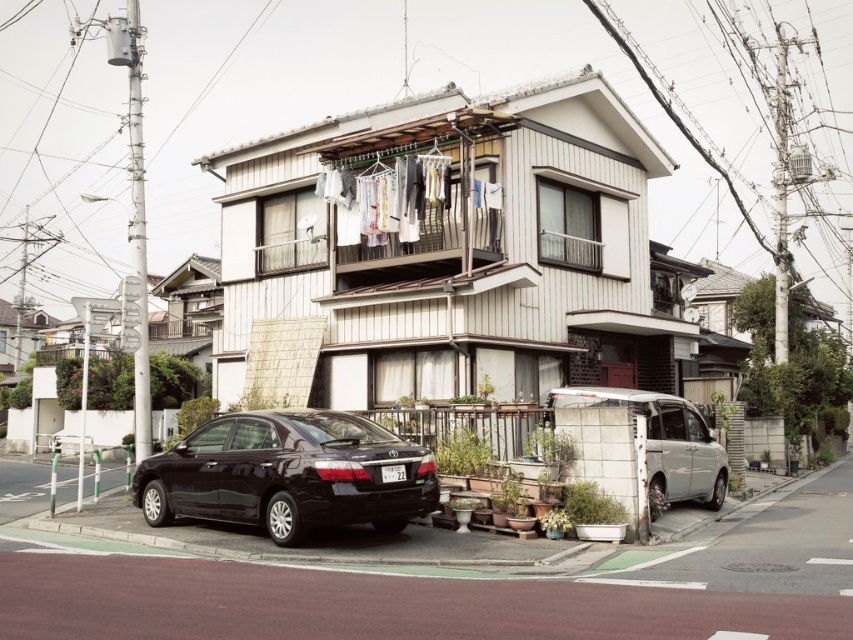
You are a delivery person trying to park your van in the driveway. You see the white fabric clothesline at upper center and the white matte van at lower right. Which object is positioned higher up in the image?

The white fabric clothesline at upper center is located above the white matte van at lower right, so it is positioned higher up in the image.

You are a delivery driver arriving at this suburban house to drop off a package. Your vehicle is a large truck that requires a 10 feet turning radius. The black matte sedan at lower left and white matte van at lower right are parked along the road. Can you safely turn around your truck in the space between these two vehicles?

The black matte sedan at lower left is in front of the white matte van at lower right, meaning there is limited space between them. Since your truck requires a 10 feet turning radius, it is unlikely you can safely turn around here due to insufficient space between the two parked vehicles.